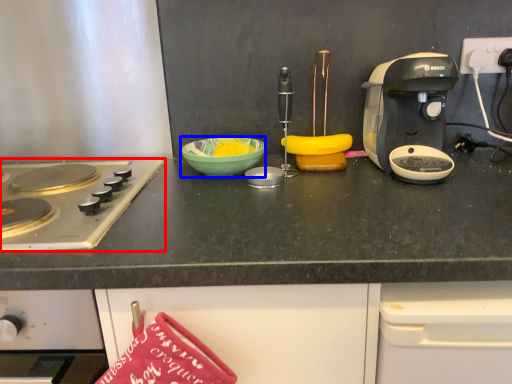
Question: Which object appears closest to the camera in this image, gas stove (highlighted by a red box) or bowl (highlighted by a blue box)?

Choices:
 (A) gas stove
 (B) bowl

Answer: (A)